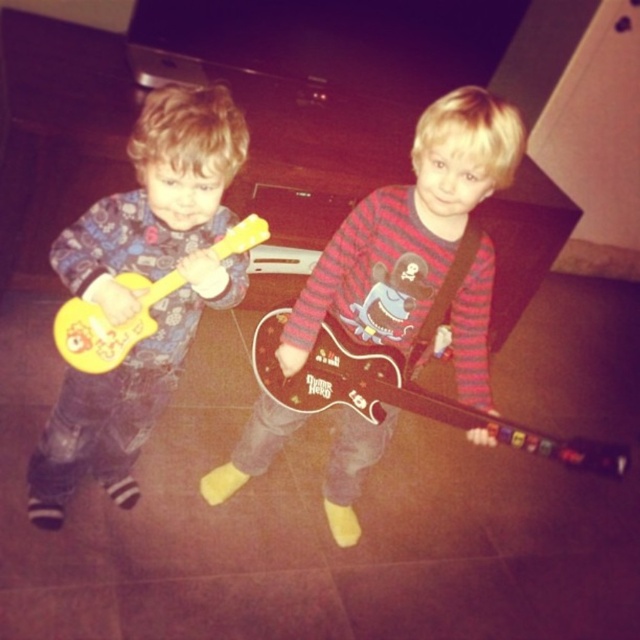
You are a parent trying to store two toy guitars in a narrow drawer. You have the matte yellow toy guitar at left and the yellow matte guitar at left. Which one is wider and might not fit?

The matte yellow toy guitar at left is wider than the yellow matte guitar at left, so it might not fit in the narrow drawer.

You are a parent trying to store two guitars in a narrow closet. The matte brown guitar at center and the matte yellow toy guitar at left are both in the living room. Which guitar should you place first to ensure both fit into the closet?

The matte yellow toy guitar at left is narrower than the matte brown guitar at center, so place the matte brown guitar at center first to utilize space effectively and ensure both fit.

You are a parent trying to hand your child a new toy. You see the matte brown guitar at center and the yellow matte guitar at left. Which guitar is closer to you so you can reach it easily?

The matte brown guitar at center is closer to you, so you can reach it easily since it is further to the viewer than the yellow matte guitar at left.